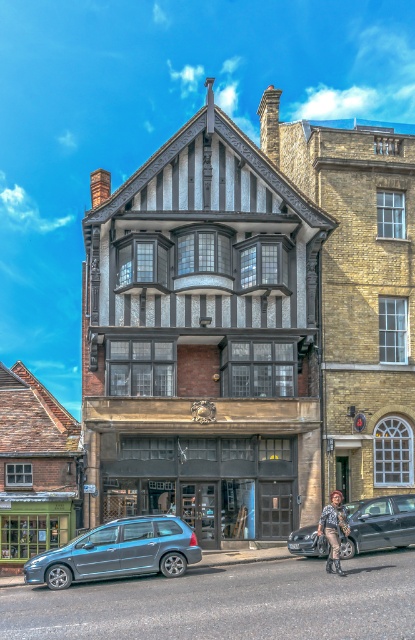
Can you confirm if metallic blue minivan at lower left is positioned to the left of leather jacket at lower right?

Correct, you'll find metallic blue minivan at lower left to the left of leather jacket at lower right.

Locate an element on the screen. The image size is (415, 640). metallic blue minivan at lower left is located at coordinates (119, 552).

Who is positioned more to the right, metallic blue minivan at lower left or shiny black car at lower right?

shiny black car at lower right is more to the right.

Between metallic blue minivan at lower left and shiny black car at lower right, which one is positioned higher?

shiny black car at lower right is above.

Who is more distant from viewer, (117, 525) or (381, 516)?

Positioned behind is point (381, 516).

Locate an element on the screen. metallic blue minivan at lower left is located at coordinates (119, 552).

Is shiny black car at lower right positioned before leather jacket at lower right?

No, it is behind leather jacket at lower right.

Can you confirm if shiny black car at lower right is positioned above leather jacket at lower right?

Actually, shiny black car at lower right is below leather jacket at lower right.

Is point (366, 509) positioned in front of point (329, 541)?

No.

Find the location of a particular element. Image resolution: width=415 pixels, height=640 pixels. shiny black car at lower right is located at coordinates (378, 524).